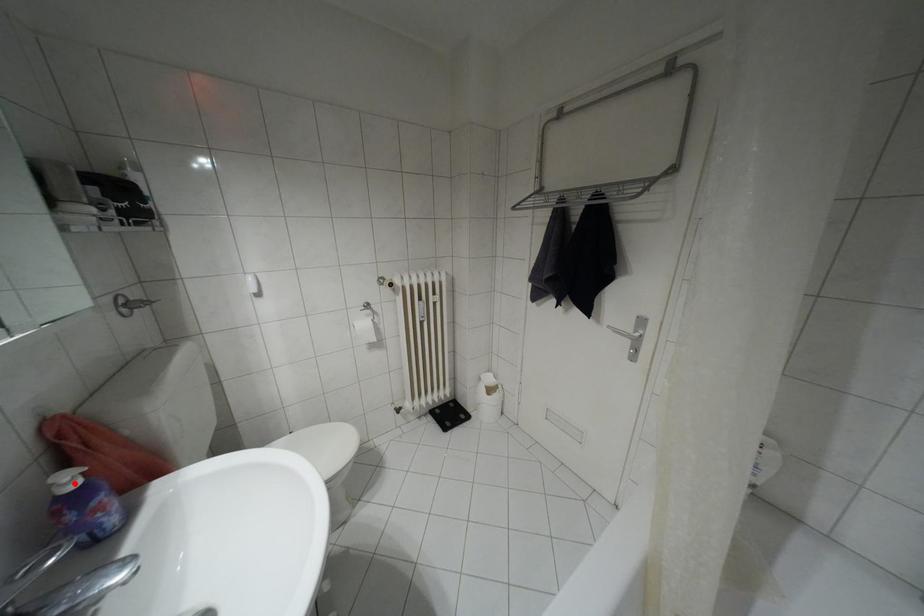
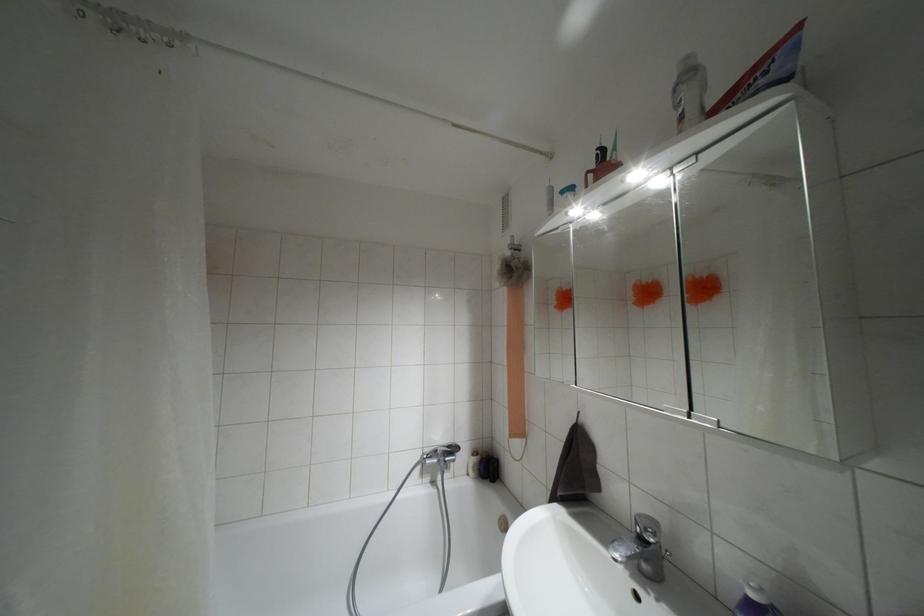
In the second image, find the point that corresponds to the highlighted location in the first image.

(751, 594)